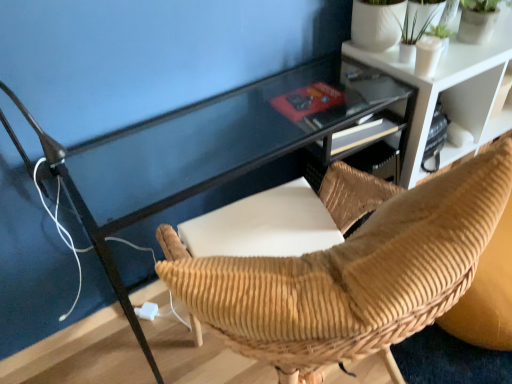
Question: Is brown corduroy chair at center to the left or to the right of green matte plant at upper right in the image?

Choices:
 (A) left
 (B) right

Answer: (A)

Question: Considering the positions of brown corduroy chair at center and green matte plant at upper right in the image, is brown corduroy chair at center wider or thinner than green matte plant at upper right?

Choices:
 (A) thin
 (B) wide

Answer: (B)

Question: Based on their relative distances, which object is nearer to the white textured shelf at upper right?

Choices:
 (A) white plastic plug at lower center
 (B) brown corduroy chair at center
 (C) green matte plant at upper right

Answer: (C)

Question: Based on their relative distances, which object is farther from the brown corduroy chair at center?

Choices:
 (A) white plastic plug at lower center
 (B) white textured shelf at upper right
 (C) green matte plant at upper right

Answer: (A)